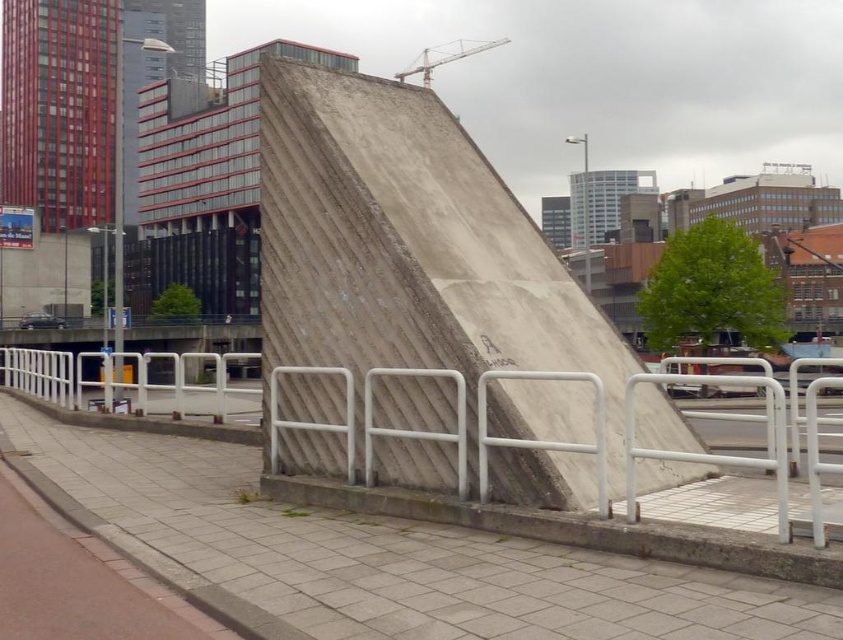
Question: Which object appears farthest from the camera in this image?

Choices:
 (A) concrete rough at center
 (B) concrete textured ramp at center

Answer: (B)

Question: Can you confirm if concrete textured ramp at center is positioned to the left of concrete rough at center?

Choices:
 (A) yes
 (B) no

Answer: (B)

Question: Which of the following is the closest to the observer?

Choices:
 (A) concrete rough at center
 (B) concrete textured ramp at center

Answer: (A)

Question: Is concrete textured ramp at center to the left of concrete rough at center from the viewer's perspective?

Choices:
 (A) no
 (B) yes

Answer: (A)

Question: Where is concrete textured ramp at center located in relation to concrete rough at center in the image?

Choices:
 (A) below
 (B) above

Answer: (B)